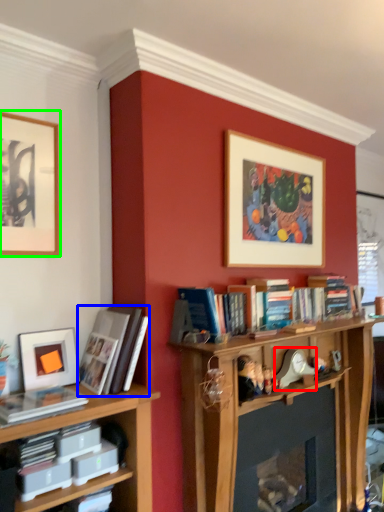
Question: Which is nearer to the toy (highlighted by a red box)? book (highlighted by a blue box) or picture frame (highlighted by a green box).

Choices:
 (A) book
 (B) picture frame

Answer: (A)